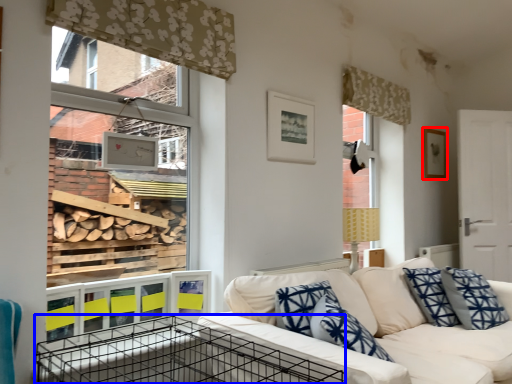
Question: Which of the following is the farthest to the observer, picture frame (highlighted by a red box) or crate (highlighted by a blue box)?

Choices:
 (A) picture frame
 (B) crate

Answer: (A)